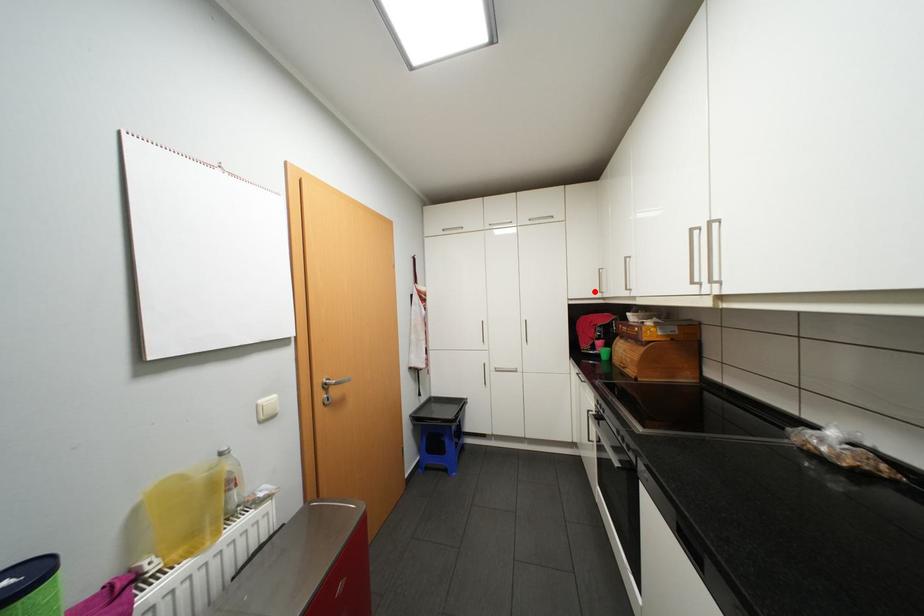
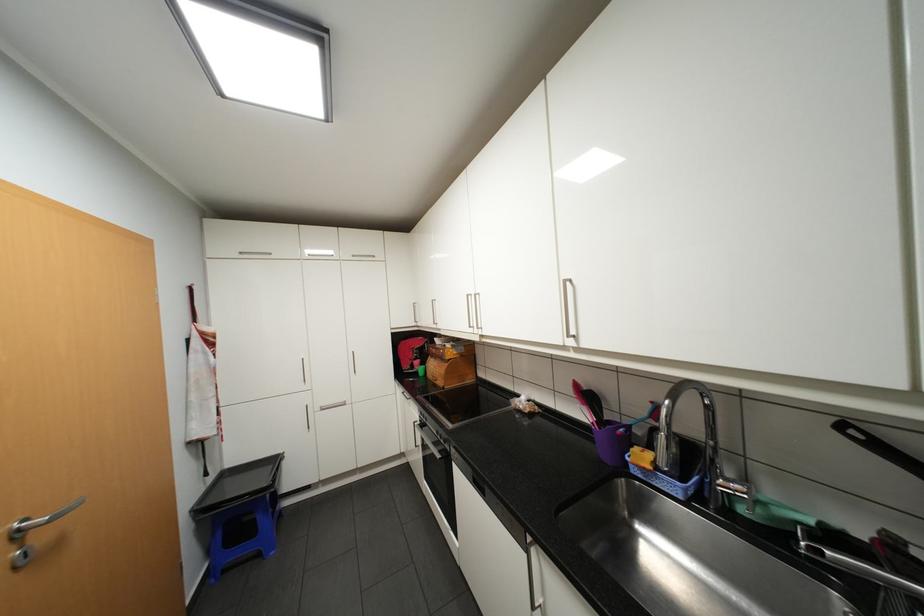
Find the pixel in the second image that matches the highlighted location in the first image.

(412, 322)